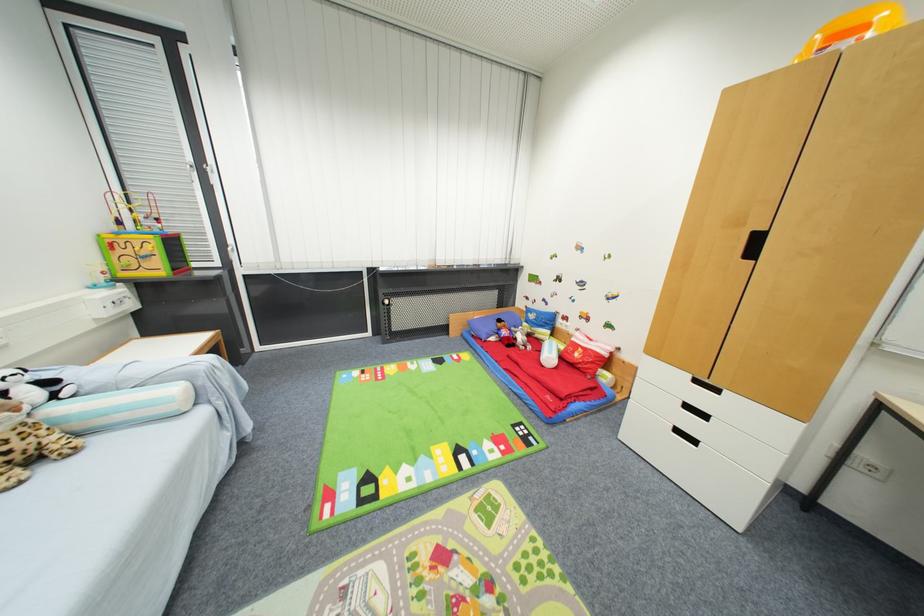
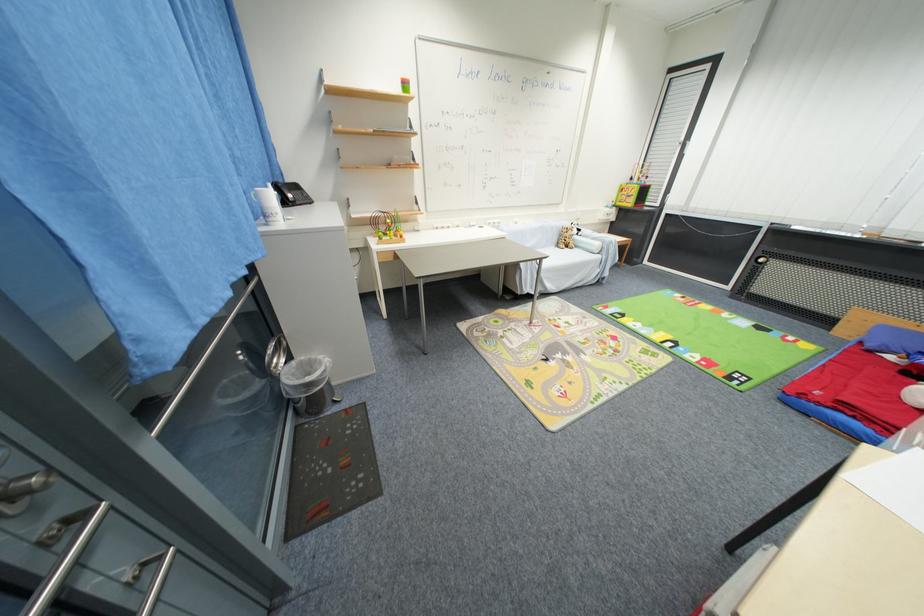
Locate, in the second image, the point that corresponds to [209,414] in the first image.

(603, 259)